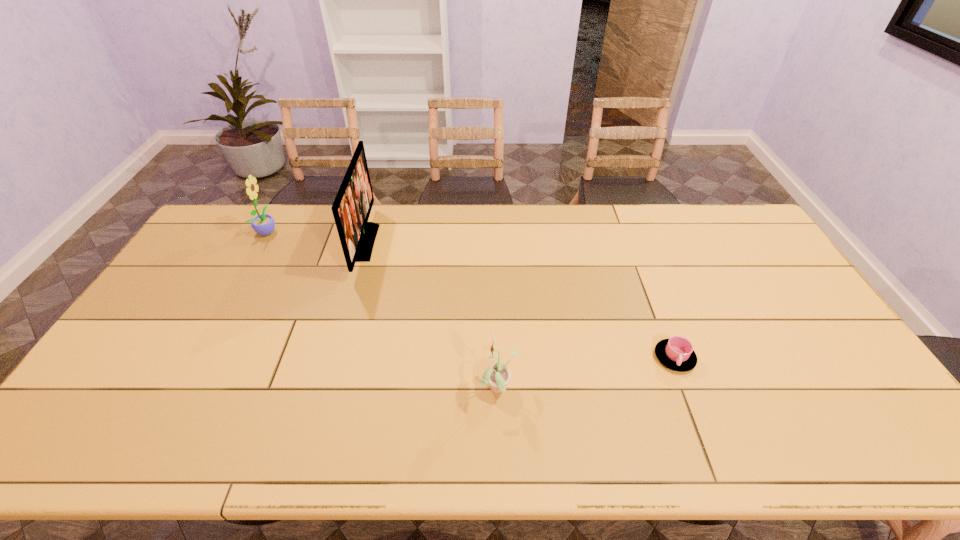
Where is `empty location between the cup and the third object from right to left`? The width and height of the screenshot is (960, 540). empty location between the cup and the third object from right to left is located at coordinates click(519, 300).

I want to click on free area in between the farther sunflower and the right sunflower, so click(383, 310).

The image size is (960, 540). Identify the location of vacant point located between the second object from left to right and the third object from left to right. (432, 316).

The height and width of the screenshot is (540, 960). What are the coordinates of `empty location between the monitor and the leftmost object` in the screenshot? It's located at (316, 237).

Image resolution: width=960 pixels, height=540 pixels. Identify the location of free space between the leftmost object and the cup. (471, 294).

Find the location of a particular element. vacant area between the right sunflower and the shortest object is located at coordinates (587, 374).

You are a GUI agent. You are given a task and a screenshot of the screen. Output one action in this format:
    pyautogui.click(x=<x>, y=<y>)
    Task: Click on the free space between the third object from left to right and the farther sunflower
    Image resolution: width=960 pixels, height=540 pixels.
    Given the screenshot: What is the action you would take?
    pyautogui.click(x=383, y=310)

At what (x,y) coordinates should I click in order to perform the action: click on free space between the right sunflower and the monitor. Please return your answer as a coordinate pair (x, y). The width and height of the screenshot is (960, 540). Looking at the image, I should click on (432, 316).

The image size is (960, 540). I want to click on object that stands as the third closest to the nearer sunflower, so click(263, 224).

Point out which object is positioned as the nearest to the rightmost object. Please provide its 2D coordinates. Your answer should be formatted as a tuple, i.e. [(x, y)], where the tuple contains the x and y coordinates of a point satisfying the conditions above.

[(497, 375)]